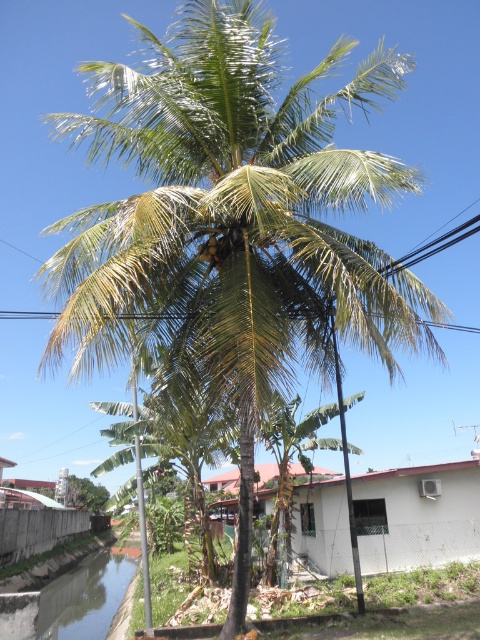
Question: Is green leafy palm tree at center positioned before green leafy coconut at center?

Choices:
 (A) no
 (B) yes

Answer: (B)

Question: Which point is farther from the camera taking this photo?

Choices:
 (A) (276, 401)
 (B) (216, 250)

Answer: (B)

Question: Which object appears closest to the camera in this image?

Choices:
 (A) white matte hut at lower center
 (B) green leafy palm tree at center
 (C) green leafy coconut at center

Answer: (B)

Question: Does white matte hut at lower center appear over green leafy coconut at center?

Choices:
 (A) no
 (B) yes

Answer: (A)

Question: Where is white matte hut at lower center located in relation to green leafy coconut at center in the image?

Choices:
 (A) below
 (B) above

Answer: (A)

Question: Which of the following is the farthest from the observer?

Choices:
 (A) white matte hut at lower center
 (B) green leafy coconut at center
 (C) green leafy palm tree at center

Answer: (A)